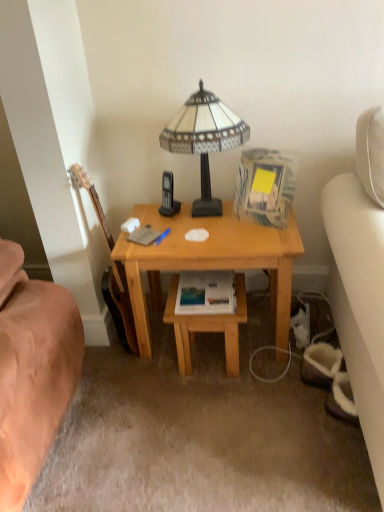
This screenshot has height=512, width=384. I want to click on free region under stained glass lampshade at center (from a real-world perspective), so click(x=208, y=210).